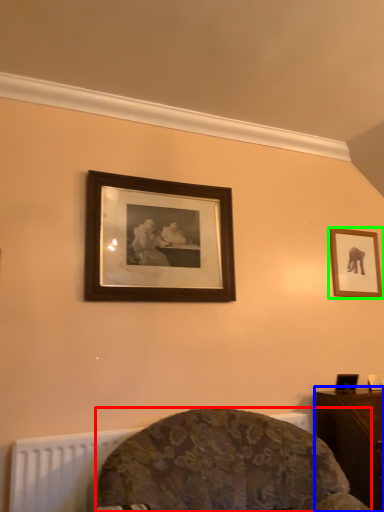
Question: Which object is positioned farthest from furniture (highlighted by a red box)? Select from table (highlighted by a blue box) and picture frame (highlighted by a green box).

Choices:
 (A) table
 (B) picture frame

Answer: (B)